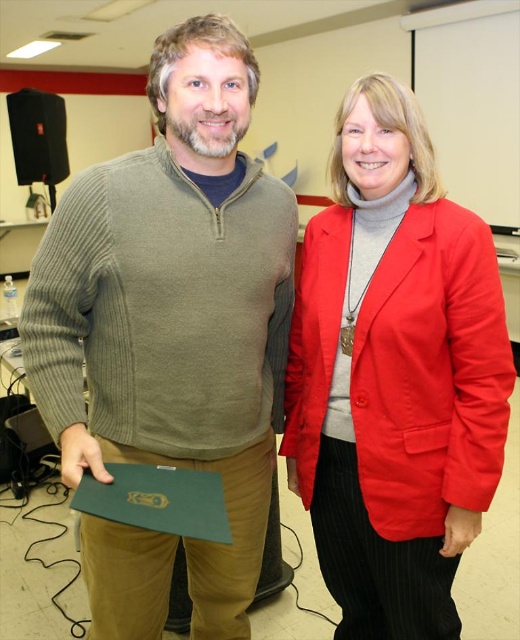
From the picture: You are a photographer setting up for a group photo in the classroom. You need to ensure that the red cotton blazer at center and the green matte folder at lower left are both visible in the frame. Given their sizes, which object might require you to adjust the camera angle more to include it in the shot?

The red cotton blazer at center is much taller than the green matte folder at lower left, so it might require adjusting the camera angle more to ensure it fits within the frame.

You are a photographer setting up for a group photo. You need to position yourself so that both the green ribbed sweater at left and the red cotton blazer at center are in focus. Which object should you focus on first to ensure both are sharp?

You should focus on the green ribbed sweater at left first because it is closer to the viewer than the red cotton blazer at center, so focusing on the closer object ensures both will be in focus.

You are a photographer positioned in front of the two people in the image. You want to take a clear photo of the green matte folder at lower left without the red cotton blazer at center blocking it. Is this possible?

The red cotton blazer at center is further to the viewer than the green matte folder at lower left, so the red cotton blazer at center will block the green matte folder at lower left. Therefore, it is not possible to take a clear photo of the green matte folder at lower left without the red cotton blazer at center blocking it.